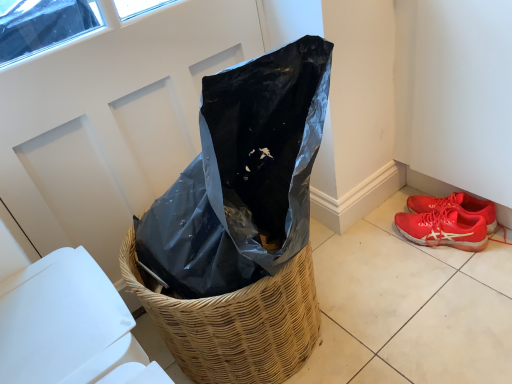
Describe the element at coordinates (236, 323) in the screenshot. I see `woven straw basket at center` at that location.

Where is `woven straw basket at center`? The height and width of the screenshot is (384, 512). woven straw basket at center is located at coordinates (236, 323).

This screenshot has width=512, height=384. Identify the location of shiny red sneakers at lower right. (446, 222).

Describe the element at coordinates (446, 222) in the screenshot. The width and height of the screenshot is (512, 384). I see `shiny red sneakers at lower right` at that location.

The width and height of the screenshot is (512, 384). Find the location of `woven straw basket at center`. woven straw basket at center is located at coordinates (236, 323).

Considering the relative positions of woven straw basket at center and shiny red sneakers at lower right in the image provided, is woven straw basket at center to the left or to the right of shiny red sneakers at lower right?

In the image, woven straw basket at center appears on the left side of shiny red sneakers at lower right.

Is the position of woven straw basket at center more distant than that of shiny red sneakers at lower right?

No, the depth of woven straw basket at center is less than that of shiny red sneakers at lower right.

Which is farther from the camera, (246,375) or (454,210)?

The point (454,210) is farther.

From the picture: From the image's perspective, between woven straw basket at center and shiny red sneakers at lower right, who is located below?

woven straw basket at center, from the image's perspective.

From a real-world perspective, which is physically above, woven straw basket at center or shiny red sneakers at lower right?

woven straw basket at center is physically above.

Is woven straw basket at center wider than shiny red sneakers at lower right?

Indeed, woven straw basket at center has a greater width compared to shiny red sneakers at lower right.

From their relative heights in the image, would you say woven straw basket at center is taller or shorter than shiny red sneakers at lower right?

In the image, woven straw basket at center appears to be taller than shiny red sneakers at lower right.

From the picture: Considering the sizes of woven straw basket at center and shiny red sneakers at lower right in the image, is woven straw basket at center bigger or smaller than shiny red sneakers at lower right?

Considering their sizes, woven straw basket at center takes up more space than shiny red sneakers at lower right.

Choose the correct answer: Is woven straw basket at center inside shiny red sneakers at lower right or outside it?

The correct answer is: outside.

Are woven straw basket at center and shiny red sneakers at lower right located far from each other?

They are positioned close to each other.

Is woven straw basket at center turned away from shiny red sneakers at lower right?

No, woven straw basket at center is not facing the opposite direction of shiny red sneakers at lower right.

Measure the distance from woven straw basket at center to shiny red sneakers at lower right.

woven straw basket at center and shiny red sneakers at lower right are 26.62 inches apart from each other.

The image size is (512, 384). Find the location of `basket that appears above the shiny red sneakers at lower right (from a real-world perspective)`. basket that appears above the shiny red sneakers at lower right (from a real-world perspective) is located at coordinates (236, 323).

From the picture: Is shiny red sneakers at lower right to the right of woven straw basket at center from the viewer's perspective?

Yes, shiny red sneakers at lower right is to the right of woven straw basket at center.

Considering the relative positions of shiny red sneakers at lower right and woven straw basket at center in the image provided, is shiny red sneakers at lower right behind woven straw basket at center?

Yes, shiny red sneakers at lower right is behind woven straw basket at center.

Between point (438, 231) and point (225, 365), which one is positioned in front?

The point (225, 365) is in front.

From the image's perspective, relative to woven straw basket at center, is shiny red sneakers at lower right above or below?

shiny red sneakers at lower right is situated higher than woven straw basket at center in the image.

From a real-world perspective, is shiny red sneakers at lower right physically located above or below woven straw basket at center?

shiny red sneakers at lower right is situated lower than woven straw basket at center in the real world.

Is shiny red sneakers at lower right thinner than woven straw basket at center?

Yes, shiny red sneakers at lower right is thinner than woven straw basket at center.

Does shiny red sneakers at lower right have a greater height compared to woven straw basket at center?

Incorrect, the height of shiny red sneakers at lower right is not larger of that of woven straw basket at center.

Is shiny red sneakers at lower right bigger than woven straw basket at center?

Actually, shiny red sneakers at lower right might be smaller than woven straw basket at center.

Can we say shiny red sneakers at lower right lies outside woven straw basket at center?

shiny red sneakers at lower right lies outside woven straw basket at center's area.

Is shiny red sneakers at lower right next to woven straw basket at center?

No, shiny red sneakers at lower right is not in contact with woven straw basket at center.

Is shiny red sneakers at lower right aimed at woven straw basket at center?

No.

Identify the location of basket on the left side of shiny red sneakers at lower right. Image resolution: width=512 pixels, height=384 pixels. (236, 323).

You are a GUI agent. You are given a task and a screenshot of the screen. Output one action in this format:
    pyautogui.click(x=<x>, y=<y>)
    Task: Click on the footwear below the woven straw basket at center (from a real-world perspective)
    
    Given the screenshot: What is the action you would take?
    pyautogui.click(x=446, y=222)

The image size is (512, 384). Find the location of `footwear that is above the woven straw basket at center (from the image's perspective)`. footwear that is above the woven straw basket at center (from the image's perspective) is located at coordinates (446, 222).